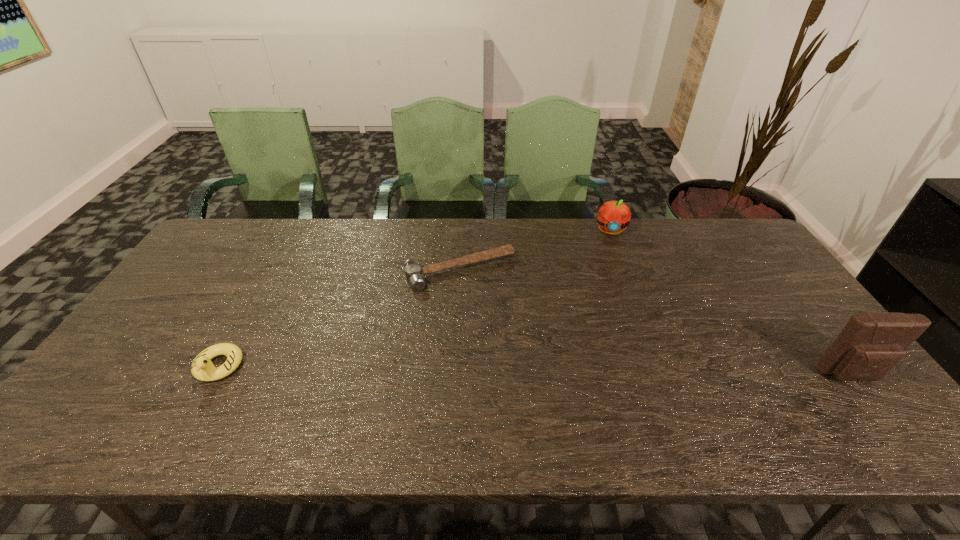
You are a GUI agent. You are given a task and a screenshot of the screen. Output one action in this format:
    pyautogui.click(x=<x>, y=<y>)
    Task: Click on the vacant space located 0.350m on the striking face of the shortest object
    The height and width of the screenshot is (540, 960).
    Given the screenshot: What is the action you would take?
    pyautogui.click(x=533, y=383)

This screenshot has width=960, height=540. Find the location of `vacant area situated 0.360m on the surface of the third shortest object`. vacant area situated 0.360m on the surface of the third shortest object is located at coordinates (612, 314).

Find the location of `free space located 0.330m on the surface of the third shortest object`. free space located 0.330m on the surface of the third shortest object is located at coordinates (611, 306).

Find the location of `free space located on the surface of the third shortest object`. free space located on the surface of the third shortest object is located at coordinates (611, 284).

This screenshot has height=540, width=960. Find the location of `hammer that is at the far edge`. hammer that is at the far edge is located at coordinates (413, 272).

Where is `apple that is at the far edge`? Image resolution: width=960 pixels, height=540 pixels. apple that is at the far edge is located at coordinates (613, 216).

Image resolution: width=960 pixels, height=540 pixels. In order to click on duckling that is positioned at the near edge in this screenshot , I will do tap(202, 368).

At what (x,y) coordinates should I click in order to perform the action: click on pouch at the near edge. Please return your answer as a coordinate pair (x, y). Looking at the image, I should click on (871, 344).

Image resolution: width=960 pixels, height=540 pixels. Find the location of `object situated at the right edge`. object situated at the right edge is located at coordinates (871, 344).

You are a GUI agent. You are given a task and a screenshot of the screen. Output one action in this format:
    pyautogui.click(x=<x>, y=<y>)
    Task: Click on the object located in the near right corner section of the desktop
    
    Given the screenshot: What is the action you would take?
    pyautogui.click(x=871, y=344)